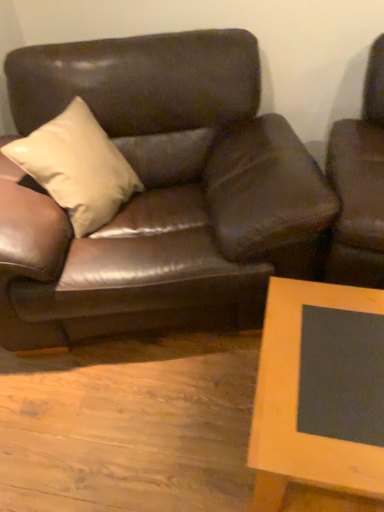
Question: Is matte brown leather couch at center wider or thinner than wooden frame at lower right?

Choices:
 (A) thin
 (B) wide

Answer: (B)

Question: Considering the positions of matte brown leather couch at center and wooden frame at lower right in the image, is matte brown leather couch at center taller or shorter than wooden frame at lower right?

Choices:
 (A) tall
 (B) short

Answer: (A)

Question: From the image's perspective, relative to wooden frame at lower right, is matte brown leather couch at center above or below?

Choices:
 (A) above
 (B) below

Answer: (A)

Question: Is wooden frame at lower right bigger or smaller than matte brown leather couch at center?

Choices:
 (A) big
 (B) small

Answer: (B)

Question: In the image, is wooden frame at lower right positioned in front of or behind matte brown leather couch at center?

Choices:
 (A) front
 (B) behind

Answer: (A)

Question: Considering the positions of wooden frame at lower right and matte brown leather couch at center in the image, is wooden frame at lower right taller or shorter than matte brown leather couch at center?

Choices:
 (A) short
 (B) tall

Answer: (A)

Question: Is wooden frame at lower right inside or outside of matte brown leather couch at center?

Choices:
 (A) outside
 (B) inside

Answer: (A)